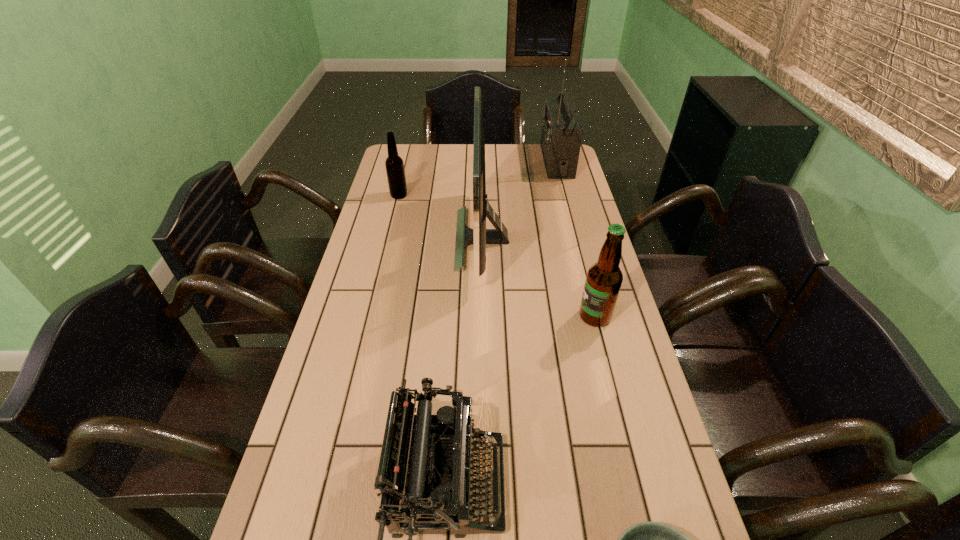
The width and height of the screenshot is (960, 540). I want to click on vacant region located 0.150m on the screen side of the monitor, so click(x=407, y=239).

At what (x,y) coordinates should I click in order to perform the action: click on free space located 0.130m on the screen side of the monitor. Please return your answer as a coordinate pair (x, y). Looking at the image, I should click on (414, 239).

The height and width of the screenshot is (540, 960). Find the location of `free space located on the label of the taller beer bottle`. free space located on the label of the taller beer bottle is located at coordinates (427, 316).

At what (x,y) coordinates should I click in order to perform the action: click on vacant point located on the label of the taller beer bottle. Please return your answer as a coordinate pair (x, y). The width and height of the screenshot is (960, 540). Looking at the image, I should click on (443, 316).

Where is `free space located on the label of the taller beer bottle`? free space located on the label of the taller beer bottle is located at coordinates click(466, 316).

At what (x,y) coordinates should I click in order to perform the action: click on vacant space located on the back of the left beer bottle. Please return your answer as a coordinate pair (x, y). This screenshot has height=540, width=960. Looking at the image, I should click on (407, 160).

Identify the location of object that is at the far edge. (561, 136).

This screenshot has height=540, width=960. I want to click on object positioned at the left edge, so click(394, 164).

The image size is (960, 540). In order to click on radio receiver at the right edge in this screenshot , I will do `click(561, 136)`.

You are a GUI agent. You are given a task and a screenshot of the screen. Output one action in this format:
    pyautogui.click(x=<x>, y=<y>)
    Task: Click on the beer bottle situated at the right edge
    
    Given the screenshot: What is the action you would take?
    pyautogui.click(x=604, y=278)